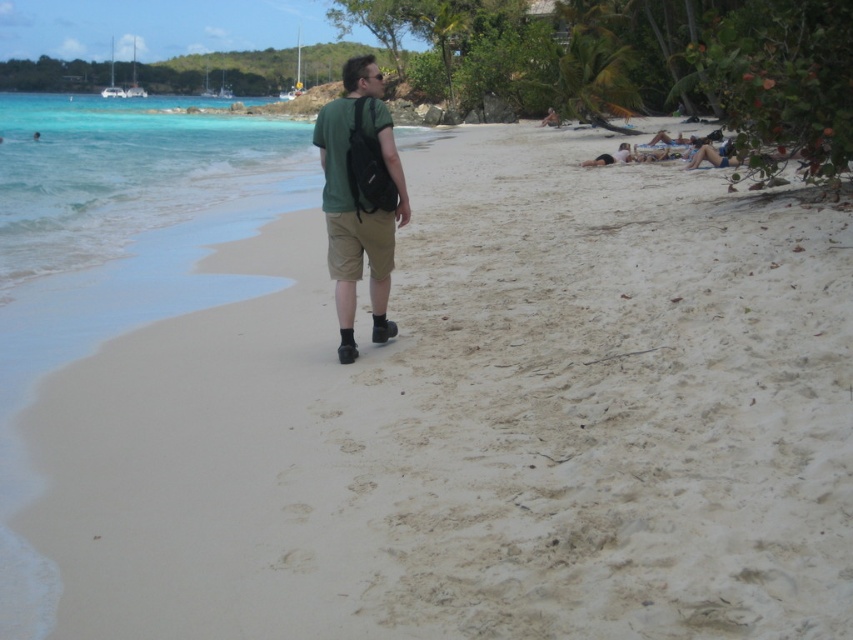
Based on the scene description, where is the matte black shirt at center located in terms of coordinates?

The matte black shirt at center is located at point (611, 156).